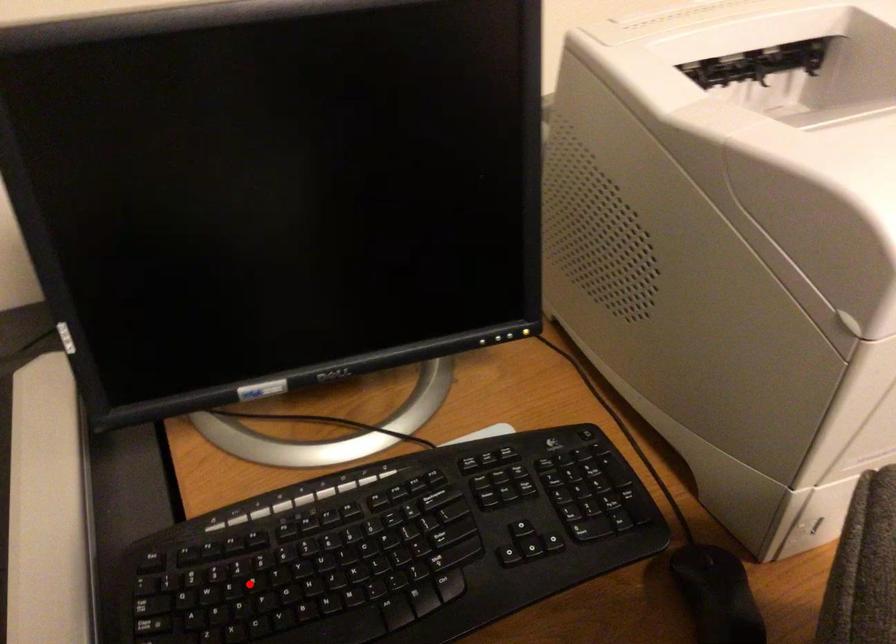
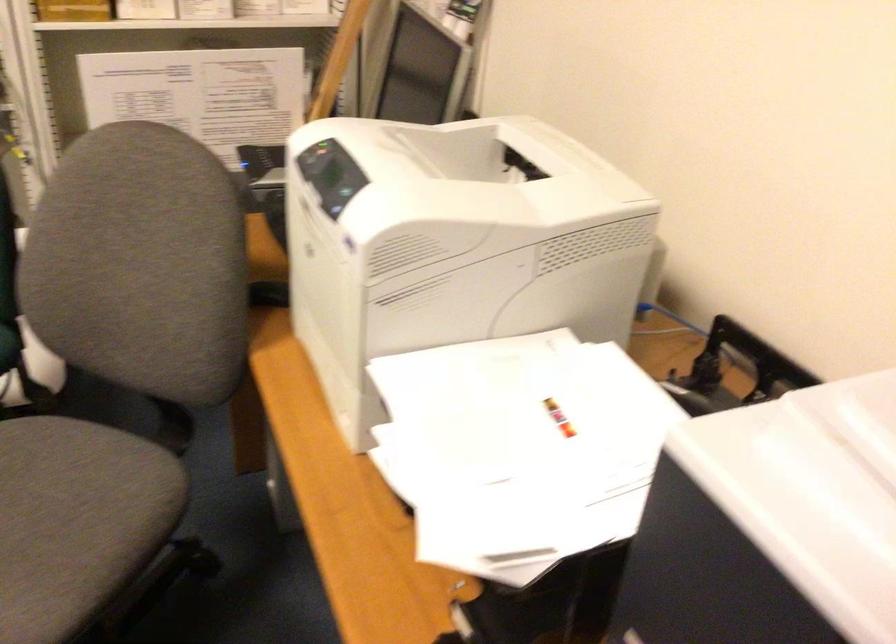
Question: I am providing you with two images of the same scene from different viewpoints. A red point is marked on the first image. At the location where the point appears in image 1, is it still visible in image 2?

Choices:
 (A) Yes
 (B) No

Answer: (B)